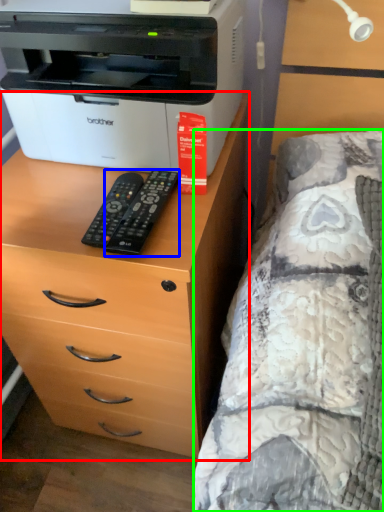
Question: Considering the real-world distances, which object is farthest from chest of drawers (highlighted by a red box)? remote (highlighted by a blue box) or bed (highlighted by a green box)?

Choices:
 (A) remote
 (B) bed

Answer: (A)